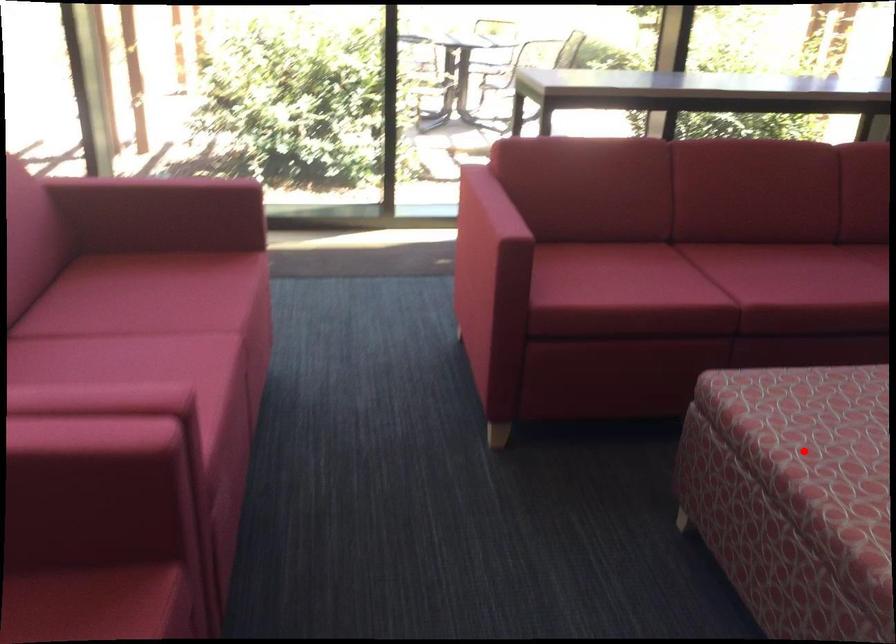
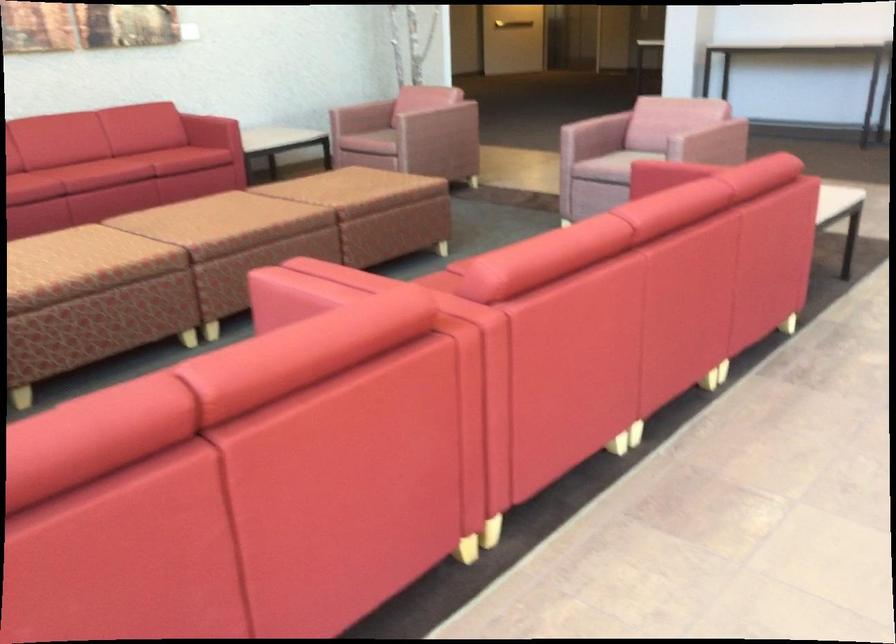
Question: I am providing you with two images of the same scene from different viewpoints. Given a red point in image1, look at the same physical point in image2. Is it:

Choices:
 (A) Closer to the viewpoint
 (B) Farther from the viewpoint

Answer: (B)